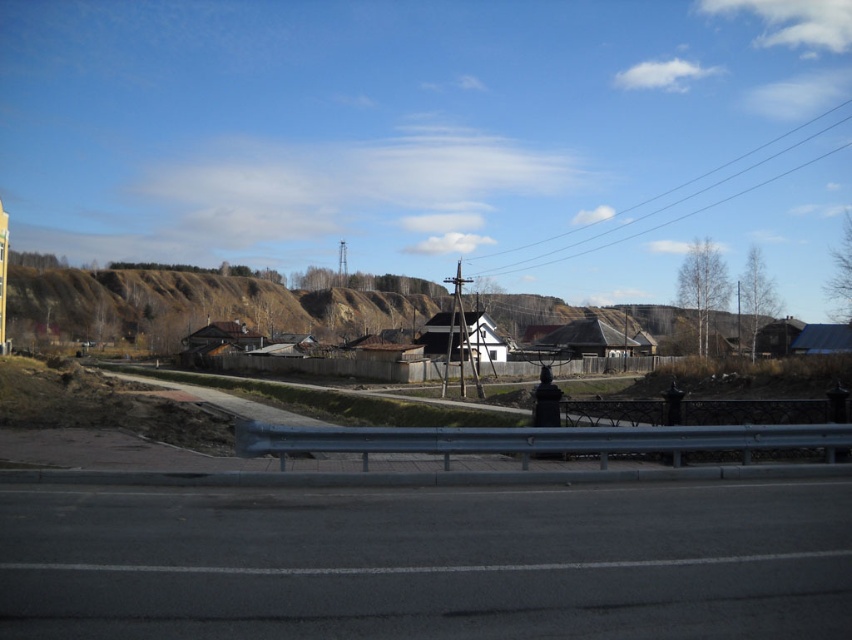
Is black asphalt highway at lower center positioned in front of black wire at upper center?

Yes.

Does black asphalt highway at lower center have a greater width compared to black wire at upper center?

No, black asphalt highway at lower center is not wider than black wire at upper center.

Identify the location of black asphalt highway at lower center. (429, 563).